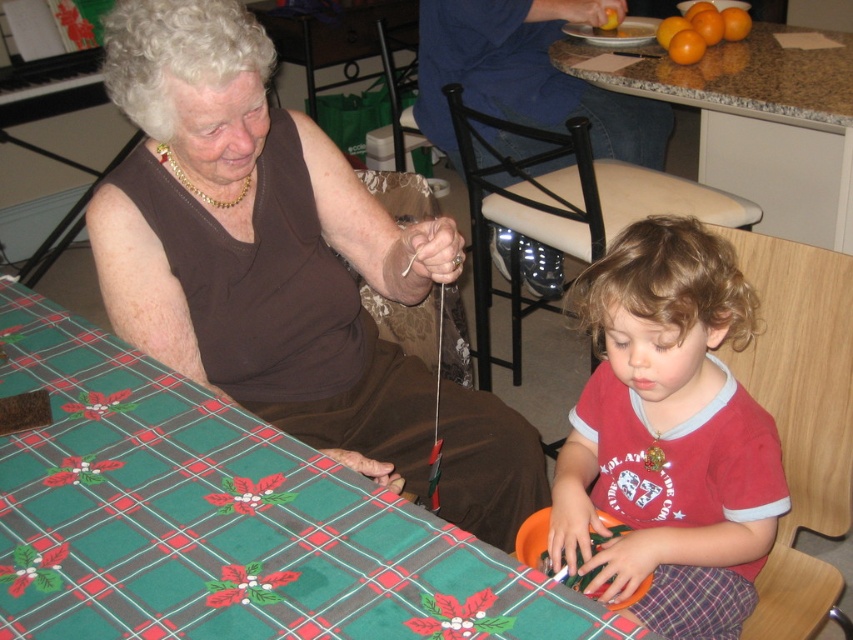
You are a guest at this holiday gathering and want to place a 12 inch long decorative ribbon on the table. The ribbon is as wide as the red cotton shirt at lower right. Will the green plaid tablecloth at lower left be wide enough to accommodate the ribbon?

The green plaid tablecloth at lower left is wider than the red cotton shirt at lower right, so the ribbon, which is as wide as the red cotton shirt at lower right, will fit on the green plaid tablecloth at lower left.

You are a guest at a holiday gathering and see the brown fabric at upper left and the green plaid tablecloth at lower left. Which object is higher in the image?

The brown fabric at upper left is much taller as green plaid tablecloth at lower left, so the brown fabric at upper left is higher in the image.